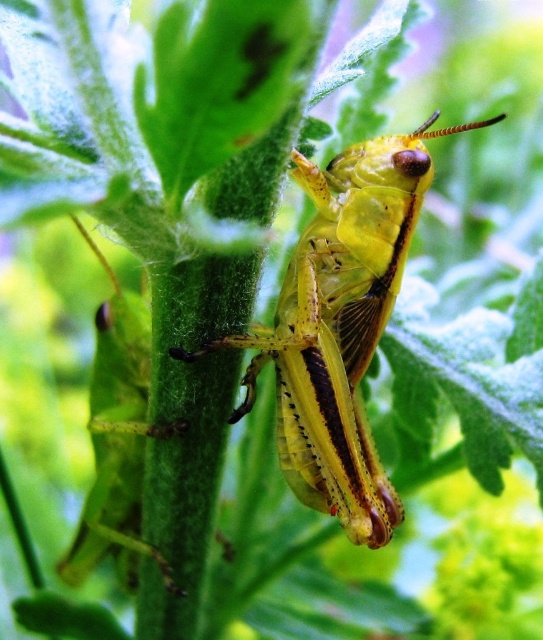
Who is taller, yellow matte grasshopper at center or green matte grasshopper at center?

Standing taller between the two is green matte grasshopper at center.

Is point (299, 186) farther from viewer compared to point (117, 484)?

No, (299, 186) is closer to viewer.

The width and height of the screenshot is (543, 640). What are the coordinates of `yellow matte grasshopper at center` in the screenshot? It's located at (339, 324).